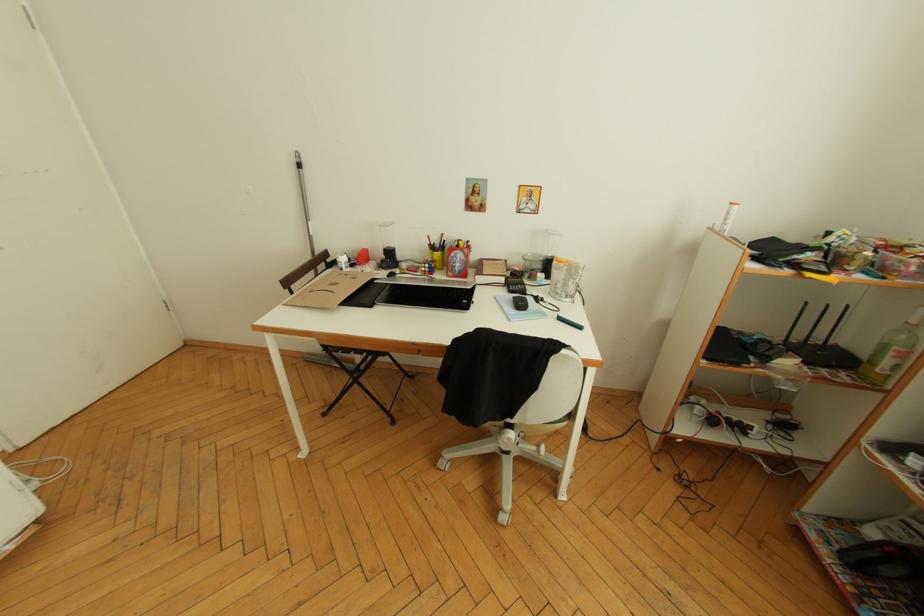
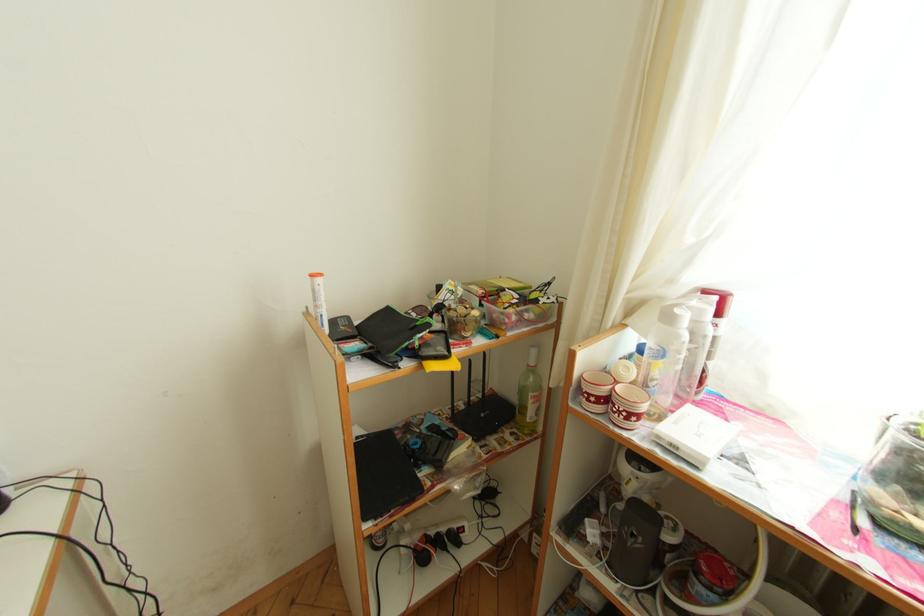
Question: The camera is either moving clockwise (left) or counter-clockwise (right) around the object. The first image is from the beginning of the video and the second image is from the end. Is the camera moving left or right when shooting the video?

Choices:
 (A) Left
 (B) Right

Answer: (A)